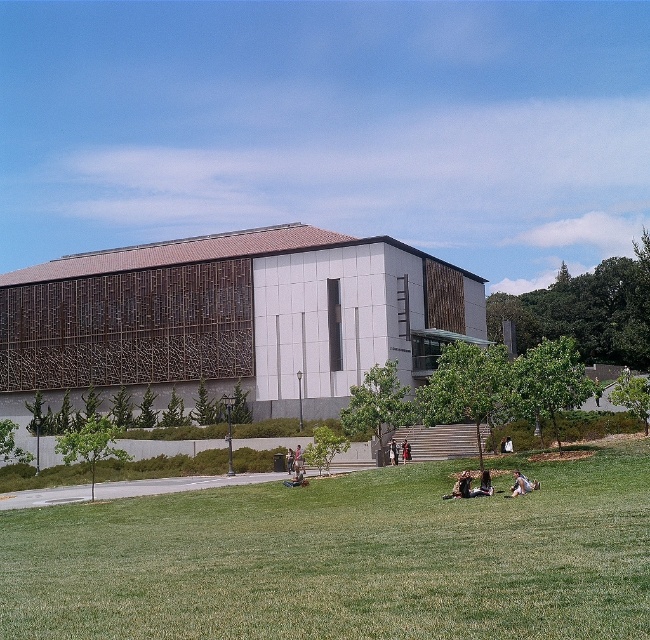
Does green grass at lower center have a greater width compared to light brown fabric person at lower right?

Yes, green grass at lower center is wider than light brown fabric person at lower right.

From the picture: Does green grass at lower center appear under light brown fabric person at lower right?

Actually, green grass at lower center is above light brown fabric person at lower right.

Between point (205, 556) and point (515, 481), which one is positioned in front?

Point (205, 556)

Where is `green grass at lower center`? green grass at lower center is located at coordinates (343, 557).

Looking at this image, who is lower down, denim jacket at center or denim jacket at lower center?

Positioned lower is denim jacket at center.

Describe the element at coordinates (296, 461) in the screenshot. I see `denim jacket at center` at that location.

At what (x,y) coordinates should I click in order to perform the action: click on denim jacket at center. Please return your answer as a coordinate pair (x, y). Looking at the image, I should click on (296, 461).

Does green grass at lower center have a lesser height compared to denim jacket at lower center?

In fact, green grass at lower center may be taller than denim jacket at lower center.

I want to click on green grass at lower center, so click(x=343, y=557).